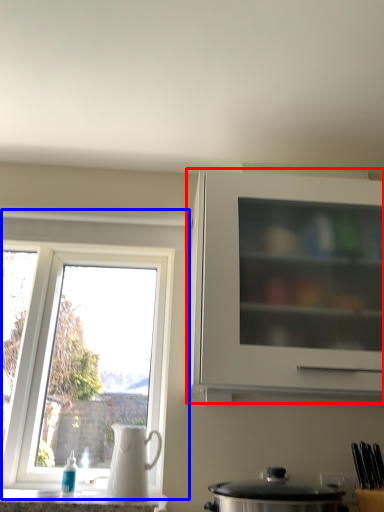
Question: Which of the following is the closest to the observer, cabinetry (highlighted by a red box) or window (highlighted by a blue box)?

Choices:
 (A) cabinetry
 (B) window

Answer: (A)